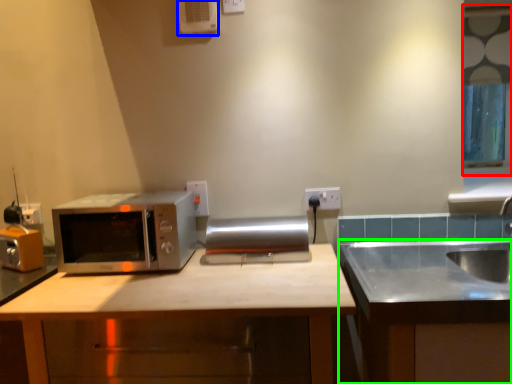
Question: Which is nearer to the window (highlighted by a red box)? air conditioner (highlighted by a blue box) or cabinetry (highlighted by a green box).

Choices:
 (A) air conditioner
 (B) cabinetry

Answer: (B)